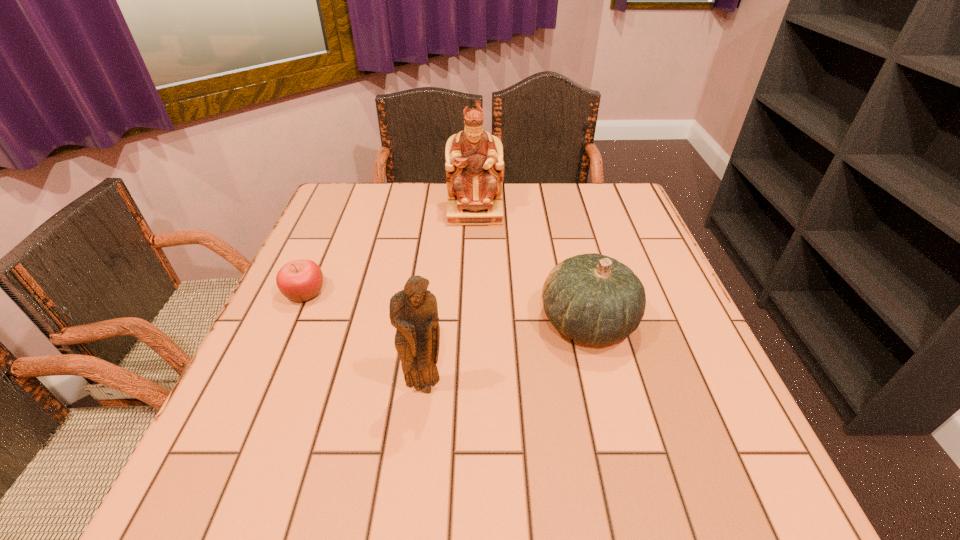
I want to click on object that is at the far edge, so click(474, 165).

You are a GUI agent. You are given a task and a screenshot of the screen. Output one action in this format:
    pyautogui.click(x=<x>, y=<y>)
    Task: Click on the object present at the left edge
    The height and width of the screenshot is (540, 960).
    Given the screenshot: What is the action you would take?
    pyautogui.click(x=299, y=280)

Identify the location of object located in the right edge section of the desktop. (591, 298).

Where is `vacant space at the far edge`? The height and width of the screenshot is (540, 960). vacant space at the far edge is located at coordinates (413, 196).

This screenshot has width=960, height=540. I want to click on free space at the near edge of the desktop, so click(552, 488).

The image size is (960, 540). What are the coordinates of `free spot at the left edge of the desktop` in the screenshot? It's located at (341, 276).

The height and width of the screenshot is (540, 960). In the image, there is a desktop. Find the location of `vacant space at the near left corner`. vacant space at the near left corner is located at coordinates (273, 504).

The height and width of the screenshot is (540, 960). In order to click on vacant space at the far right corner of the desktop in this screenshot , I will do `click(617, 226)`.

Find the location of `vacant space that is in between the rightmost object and the farther figurine`. vacant space that is in between the rightmost object and the farther figurine is located at coordinates (532, 267).

Find the location of a particular element. Image resolution: width=960 pixels, height=540 pixels. blank region between the nearer figurine and the rightmost object is located at coordinates (506, 354).